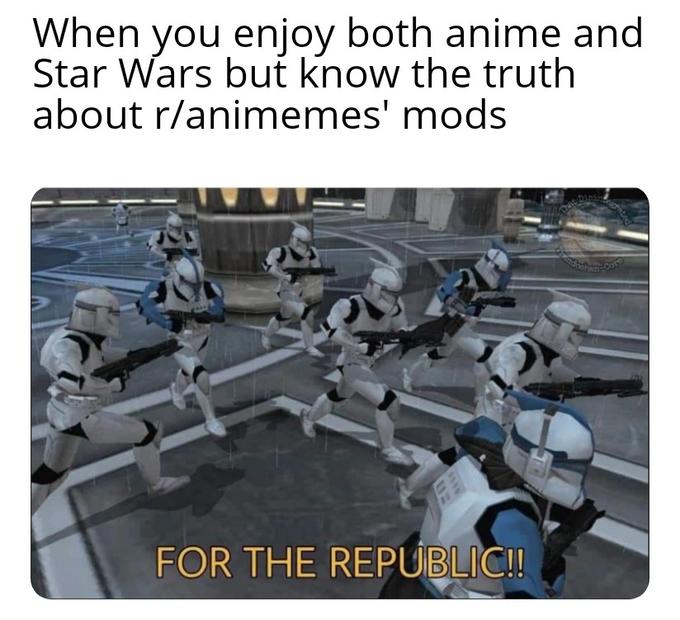
Locate an element on the screen. This screenshot has width=680, height=620. floor is located at coordinates [x=424, y=250].